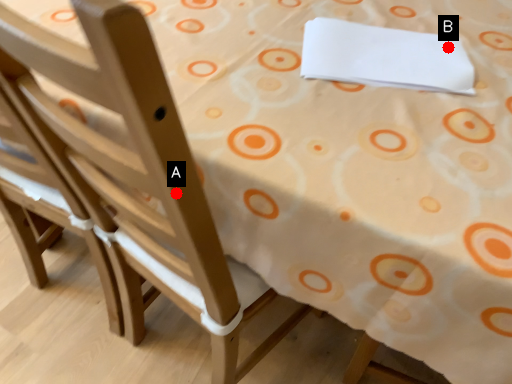
Question: Two points are circled on the image, labeled by A and B beside each circle. Among these points, which one is farthest from the camera?

Choices:
 (A) A is further
 (B) B is further

Answer: (B)